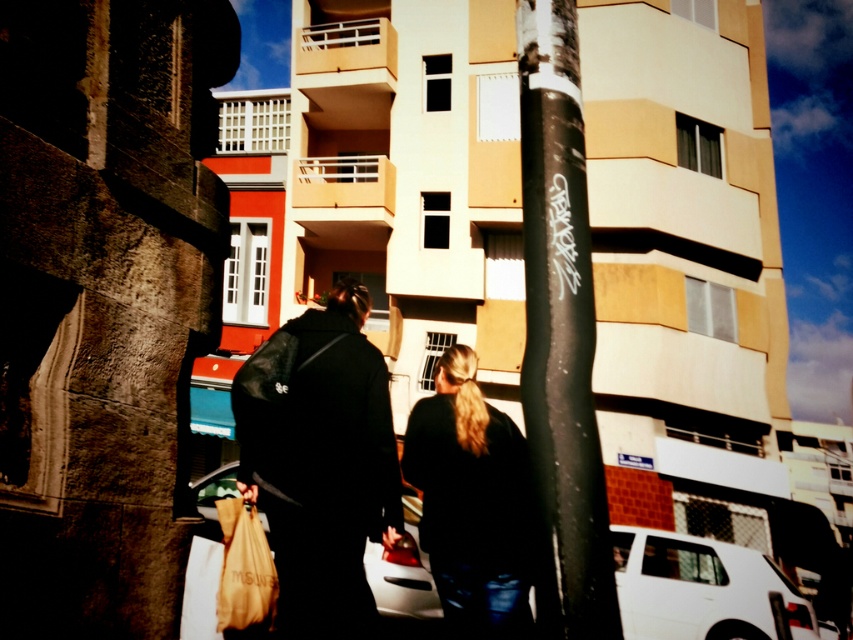
Question: Which point is farther from the camera taking this photo?

Choices:
 (A) (560, 13)
 (B) (473, 465)

Answer: (B)

Question: Can you confirm if black matte pole at center is thinner than black leather jacket at center?

Choices:
 (A) no
 (B) yes

Answer: (B)

Question: Is black leather jacket at center below black matte jacket at center?

Choices:
 (A) yes
 (B) no

Answer: (B)

Question: Can you confirm if black leather jacket at center is positioned above matte brown paper bag at lower left?

Choices:
 (A) no
 (B) yes

Answer: (B)

Question: Which point appears farthest from the camera in this image?

Choices:
 (A) (242, 528)
 (B) (450, 605)
 (C) (322, 540)

Answer: (B)

Question: Which point is farther from the camera taking this photo?

Choices:
 (A) (x=444, y=595)
 (B) (x=357, y=570)

Answer: (A)